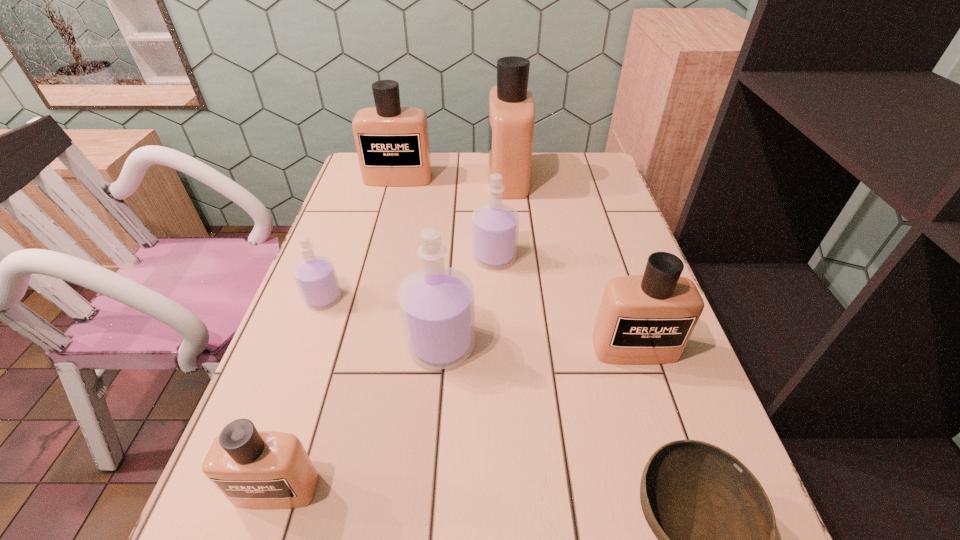
Where is `object located at the right edge`? The width and height of the screenshot is (960, 540). object located at the right edge is located at coordinates (643, 319).

Locate an element on the screen. object located at the far left corner is located at coordinates (392, 142).

In the image, there is a desktop. At what (x,y) coordinates should I click in order to perform the action: click on free region at the far edge. Please return your answer as a coordinate pair (x, y). Looking at the image, I should click on (484, 162).

Identify the location of free space at the left edge of the desktop. This screenshot has height=540, width=960. (382, 227).

Identify the location of vacant space at the far right corner. This screenshot has width=960, height=540. (589, 174).

Find the location of a particular element. The image size is (960, 540). vacant region between the third smallest beige perfume and the third farthest beige perfume is located at coordinates (516, 263).

Where is `vacant area between the smallest beige perfume and the third smallest beige perfume`? vacant area between the smallest beige perfume and the third smallest beige perfume is located at coordinates (337, 333).

The image size is (960, 540). I want to click on free spot between the nearest purple perfume and the tallest perfume, so click(x=474, y=261).

Find the location of a particular element. The image size is (960, 540). blank region between the rightmost beige perfume and the tallest perfume is located at coordinates (571, 263).

Locate an element on the screen. free spot between the rightmost beige perfume and the farthest purple perfume is located at coordinates (564, 302).